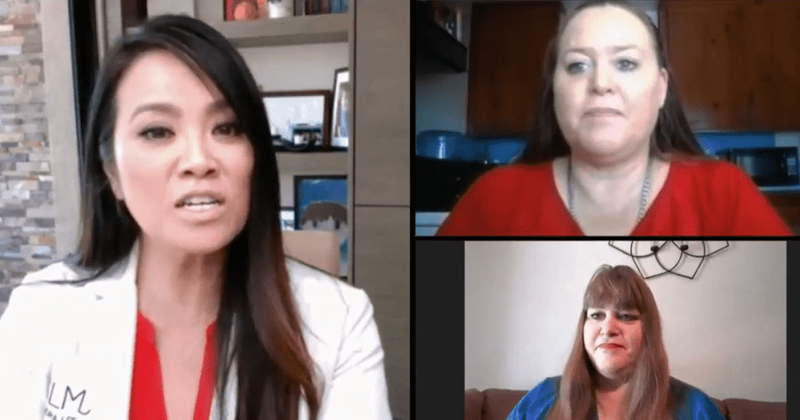
Locate an element on the screen. This screenshot has height=420, width=800. shelves is located at coordinates (314, 26), (328, 160).